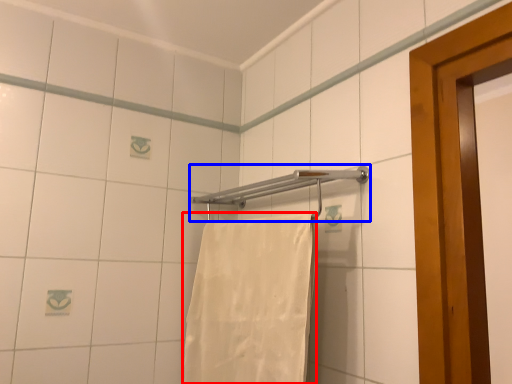
Question: Which point is closer to the camera, towel (highlighted by a red box) or towel bar (highlighted by a blue box)?

Choices:
 (A) towel
 (B) towel bar

Answer: (A)